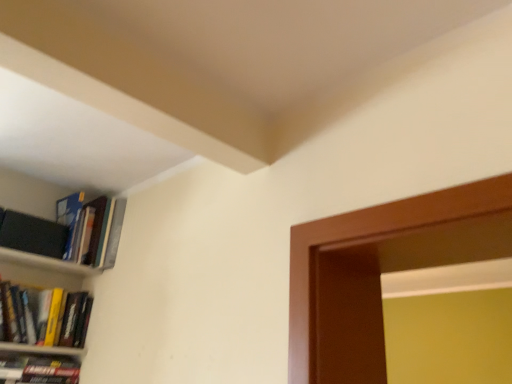
What is the approximate height of hardcover book at left, which appears as the second book when viewed from the top?

hardcover book at left, which appears as the second book when viewed from the top, is 8.50 inches tall.

Locate an element on the screen. The image size is (512, 384). hardcover book at left, which is counted as the first book, starting from the bottom is located at coordinates (45, 316).

In order to face hardcover book at left, which is counted as the first book, starting from the bottom, should I rotate leftwards or rightwards?

Rotate your view left by about 26.457°.

Image resolution: width=512 pixels, height=384 pixels. Describe the element at coordinates (45, 316) in the screenshot. I see `hardcover book at left, which appears as the second book when viewed from the top` at that location.

How much space does hardcover books at upper left, placed as the first book when sorted from top to bottom, occupy horizontally?

10.96 inches.

This screenshot has height=384, width=512. Describe the element at coordinates (96, 232) in the screenshot. I see `hardcover books at upper left, the second book when ordered from bottom to top` at that location.

What is the approximate height of hardcover books at upper left, the second book when ordered from bottom to top?

hardcover books at upper left, the second book when ordered from bottom to top, is 12.03 inches in height.

Find the location of a particular element. Image resolution: width=512 pixels, height=384 pixels. hardcover books at upper left, placed as the first book when sorted from top to bottom is located at coordinates (96, 232).

Find the location of a particular element. hardcover book at left, which is counted as the first book, starting from the bottom is located at coordinates (45, 316).

Visually, is hardcover book at left, which appears as the second book when viewed from the top, positioned to the left or to the right of hardcover books at upper left, the second book when ordered from bottom to top?

hardcover book at left, which appears as the second book when viewed from the top, is to the left of hardcover books at upper left, the second book when ordered from bottom to top.

Which object is closer to the camera, hardcover book at left, which is counted as the first book, starting from the bottom, or hardcover books at upper left, the second book when ordered from bottom to top?

hardcover book at left, which is counted as the first book, starting from the bottom, is in front.

Is point (41, 336) less distant than point (96, 256)?

Yes, point (41, 336) is closer to viewer.

From the image's perspective, between hardcover book at left, which is counted as the first book, starting from the bottom, and hardcover books at upper left, the second book when ordered from bottom to top, who is located below?

hardcover book at left, which is counted as the first book, starting from the bottom, appears lower in the image.

From a real-world perspective, which is physically above, hardcover book at left, which appears as the second book when viewed from the top, or hardcover books at upper left, placed as the first book when sorted from top to bottom?

hardcover books at upper left, placed as the first book when sorted from top to bottom, is physically above.

Considering the relative sizes of hardcover book at left, which is counted as the first book, starting from the bottom, and hardcover books at upper left, the second book when ordered from bottom to top, in the image provided, is hardcover book at left, which is counted as the first book, starting from the bottom, wider than hardcover books at upper left, the second book when ordered from bottom to top,?

No.

From their relative heights in the image, would you say hardcover book at left, which appears as the second book when viewed from the top, is taller or shorter than hardcover books at upper left, the second book when ordered from bottom to top?

In the image, hardcover book at left, which appears as the second book when viewed from the top, appears to be shorter than hardcover books at upper left, the second book when ordered from bottom to top.

Between hardcover book at left, which appears as the second book when viewed from the top, and hardcover books at upper left, the second book when ordered from bottom to top, which one has smaller size?

hardcover book at left, which appears as the second book when viewed from the top, is smaller.

Is hardcover book at left, which appears as the second book when viewed from the top, not inside hardcover books at upper left, the second book when ordered from bottom to top?

Indeed, hardcover book at left, which appears as the second book when viewed from the top, is completely outside hardcover books at upper left, the second book when ordered from bottom to top.

Are hardcover book at left, which is counted as the first book, starting from the bottom, and hardcover books at upper left, the second book when ordered from bottom to top, making contact?

No.

Could you tell me if hardcover book at left, which appears as the second book when viewed from the top, is turned towards hardcover books at upper left, the second book when ordered from bottom to top?

No, hardcover book at left, which appears as the second book when viewed from the top, is not facing towards hardcover books at upper left, the second book when ordered from bottom to top.

How different are the orientations of hardcover book at left, which appears as the second book when viewed from the top, and hardcover books at upper left, the second book when ordered from bottom to top, in degrees?

The angular difference between hardcover book at left, which appears as the second book when viewed from the top, and hardcover books at upper left, the second book when ordered from bottom to top, is 0.00072 degrees.

Based on the photo, could you measure the distance between hardcover book at left, which is counted as the first book, starting from the bottom, and hardcover books at upper left, the second book when ordered from bottom to top?

They are 25.55 centimeters apart.

In order to click on book on the left of hardcover books at upper left, placed as the first book when sorted from top to bottom in this screenshot , I will do `click(45, 316)`.

Which is more to the left, hardcover books at upper left, the second book when ordered from bottom to top, or hardcover book at left, which appears as the second book when viewed from the top?

From the viewer's perspective, hardcover book at left, which appears as the second book when viewed from the top, appears more on the left side.

Based on the photo, between hardcover books at upper left, placed as the first book when sorted from top to bottom, and hardcover book at left, which appears as the second book when viewed from the top, which one is positioned in front?

hardcover book at left, which appears as the second book when viewed from the top.

Considering the positions of point (88, 227) and point (77, 320), is point (88, 227) closer or farther from the camera than point (77, 320)?

Point (88, 227).

From the image's perspective, is hardcover books at upper left, placed as the first book when sorted from top to bottom, on hardcover book at left, which appears as the second book when viewed from the top?

Correct, hardcover books at upper left, placed as the first book when sorted from top to bottom, appears higher than hardcover book at left, which appears as the second book when viewed from the top, in the image.

From a real-world perspective, is hardcover books at upper left, placed as the first book when sorted from top to bottom, over hardcover book at left, which is counted as the first book, starting from the bottom?

Yes.

Considering the relative sizes of hardcover books at upper left, the second book when ordered from bottom to top, and hardcover book at left, which appears as the second book when viewed from the top, in the image provided, is hardcover books at upper left, the second book when ordered from bottom to top, thinner than hardcover book at left, which appears as the second book when viewed from the top,?

In fact, hardcover books at upper left, the second book when ordered from bottom to top, might be wider than hardcover book at left, which appears as the second book when viewed from the top.

Looking at this image, is hardcover books at upper left, the second book when ordered from bottom to top, taller than hardcover book at left, which appears as the second book when viewed from the top?

Yes.

Between hardcover books at upper left, placed as the first book when sorted from top to bottom, and hardcover book at left, which is counted as the first book, starting from the bottom, which one has larger size?

hardcover books at upper left, placed as the first book when sorted from top to bottom.

Is hardcover book at left, which appears as the second book when viewed from the top, inside hardcover books at upper left, the second book when ordered from bottom to top?

No, hardcover book at left, which appears as the second book when viewed from the top, is not surrounded by hardcover books at upper left, the second book when ordered from bottom to top.

From the picture: Is hardcover books at upper left, the second book when ordered from bottom to top, with hardcover book at left, which is counted as the first book, starting from the bottom?

hardcover books at upper left, the second book when ordered from bottom to top, and hardcover book at left, which is counted as the first book, starting from the bottom, are clearly separated.

In the scene shown: Is hardcover books at upper left, placed as the first book when sorted from top to bottom, facing towards hardcover book at left, which appears as the second book when viewed from the top?

No.

Could you measure the distance between hardcover books at upper left, the second book when ordered from bottom to top, and hardcover book at left, which appears as the second book when viewed from the top?

A distance of 10.06 inches exists between hardcover books at upper left, the second book when ordered from bottom to top, and hardcover book at left, which appears as the second book when viewed from the top.

The height and width of the screenshot is (384, 512). In order to click on book below the hardcover books at upper left, placed as the first book when sorted from top to bottom (from the image's perspective) in this screenshot , I will do `click(45, 316)`.

This screenshot has width=512, height=384. I want to click on book located in front of the hardcover books at upper left, the second book when ordered from bottom to top, so click(45, 316).

I want to click on book beneath the hardcover books at upper left, placed as the first book when sorted from top to bottom (from a real-world perspective), so click(45, 316).